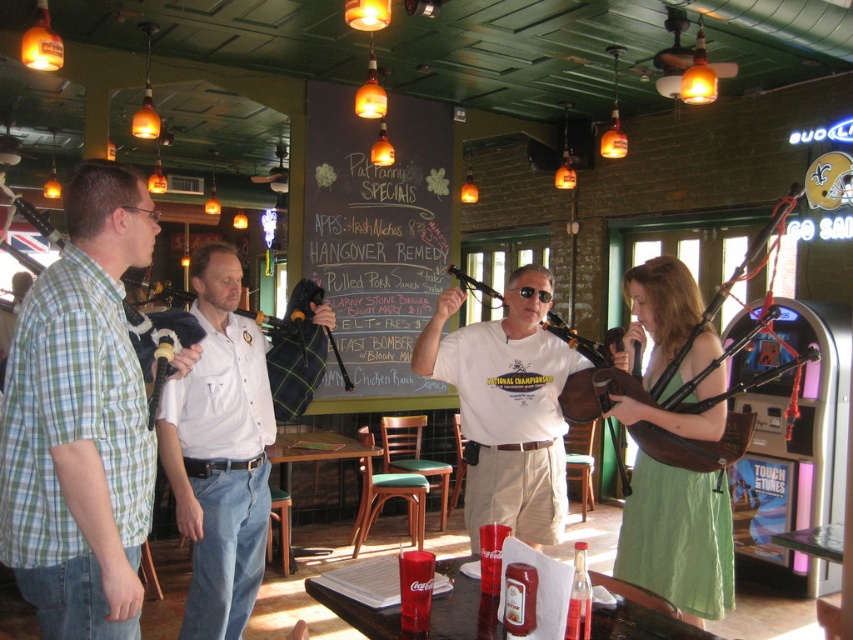
Which is more to the right, chalkboard menu at center or white cotton shirt at center?

chalkboard menu at center

In order to click on chalkboard menu at center in this screenshot , I will do `click(376, 228)`.

Does green plaid shirt at left appear under white cotton shirt at center?

Actually, green plaid shirt at left is above white cotton shirt at center.

What do you see at coordinates (80, 420) in the screenshot? This screenshot has width=853, height=640. I see `green plaid shirt at left` at bounding box center [80, 420].

You are a GUI agent. You are given a task and a screenshot of the screen. Output one action in this format:
    pyautogui.click(x=<x>, y=<y>)
    Task: Click on the green plaid shirt at left
    The height and width of the screenshot is (640, 853).
    Given the screenshot: What is the action you would take?
    pyautogui.click(x=80, y=420)

The image size is (853, 640). What do you see at coordinates (508, 406) in the screenshot?
I see `matte white t-shirt at center` at bounding box center [508, 406].

Who is positioned more to the left, matte white t-shirt at center or matte brown bagpipes at center?

Positioned to the left is matte white t-shirt at center.

Does point (512, 508) come behind point (715, 392)?

Yes.

Where is `matte white t-shirt at center`? The height and width of the screenshot is (640, 853). matte white t-shirt at center is located at coordinates (508, 406).